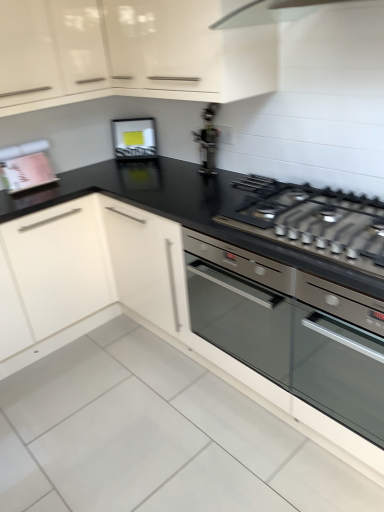
Question: From the image's perspective, is pink matte book at upper left, which appears as the 3th appliance when viewed from the right, above satin silver oven at center?

Choices:
 (A) no
 (B) yes

Answer: (B)

Question: From a real-world perspective, does pink matte book at upper left, which appears as the 3th appliance when viewed from the right, sit lower than satin silver oven at center?

Choices:
 (A) yes
 (B) no

Answer: (B)

Question: Is pink matte book at upper left, the first appliance from the left, facing towards satin silver oven at center?

Choices:
 (A) no
 (B) yes

Answer: (B)

Question: From a real-world perspective, is pink matte book at upper left, the first appliance from the left, over satin silver oven at center?

Choices:
 (A) yes
 (B) no

Answer: (A)

Question: Is pink matte book at upper left, which appears as the 3th appliance when viewed from the right, thinner than satin silver oven at center?

Choices:
 (A) yes
 (B) no

Answer: (A)

Question: Does point (11, 152) appear closer or farther from the camera than point (3, 76)?

Choices:
 (A) closer
 (B) farther

Answer: (B)

Question: Considering the positions of pink matte book at upper left, the first appliance from the left, and glossy white cabinet at upper center in the image, is pink matte book at upper left, the first appliance from the left, wider or thinner than glossy white cabinet at upper center?

Choices:
 (A) thin
 (B) wide

Answer: (A)

Question: From a real-world perspective, is pink matte book at upper left, the first appliance from the left, positioned above or below glossy white cabinet at upper center?

Choices:
 (A) below
 (B) above

Answer: (A)

Question: In terms of height, does pink matte book at upper left, which appears as the 3th appliance when viewed from the right, look taller or shorter compared to glossy white cabinet at upper center?

Choices:
 (A) tall
 (B) short

Answer: (B)

Question: Based on their positions, is satin silver oven at center located to the left or right of pink matte book at upper left, the first appliance from the left?

Choices:
 (A) left
 (B) right

Answer: (B)

Question: Is point (190, 251) closer or farther from the camera than point (14, 145)?

Choices:
 (A) closer
 (B) farther

Answer: (A)

Question: From the image's perspective, is satin silver oven at center positioned above or below pink matte book at upper left, the first appliance from the left?

Choices:
 (A) below
 (B) above

Answer: (A)

Question: From a real-world perspective, relative to pink matte book at upper left, the first appliance from the left, is satin silver oven at center vertically above or below?

Choices:
 (A) below
 (B) above

Answer: (A)

Question: Is point (130, 151) closer or farther from the camera than point (299, 219)?

Choices:
 (A) farther
 (B) closer

Answer: (A)

Question: Considering the positions of matte black frame at upper center, the 2th appliance positioned from the left, and metallic silver gas stove at center in the image, is matte black frame at upper center, the 2th appliance positioned from the left, taller or shorter than metallic silver gas stove at center?

Choices:
 (A) tall
 (B) short

Answer: (A)